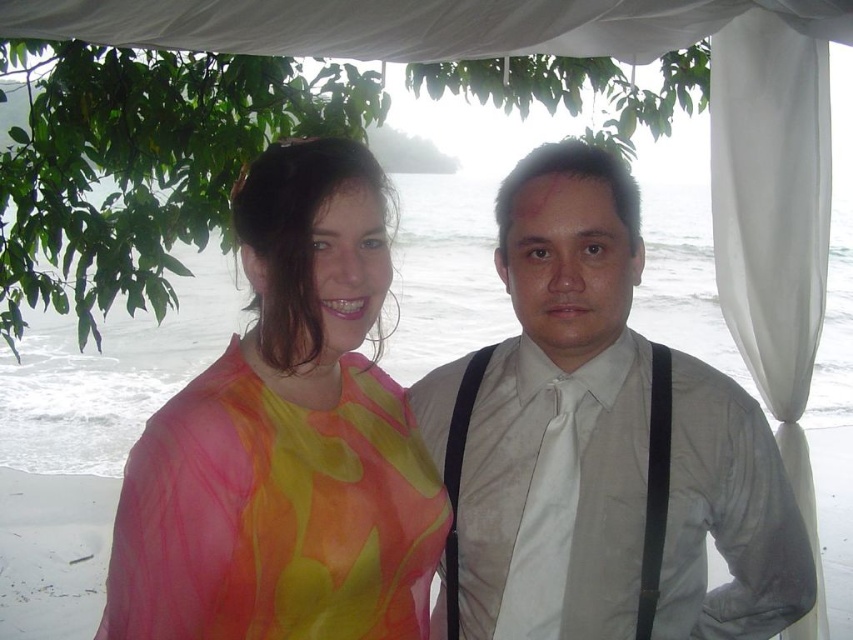
You are standing in front of the canopy at the beach. There are two points marked in the image. The first point is at coordinates point [3,337] and the second point is at point [804,358]. Which point is closer to you?

Point [3,337] is closer to you because it is further to the viewer than point [804,358].

You are a photographer setting up for a beach wedding photo session. You need to ensure that both the translucent floral blouse at center and the white satin tie at center are clearly visible in the frame. Given their sizes, which one might require more careful positioning to avoid being overshadowed by the other?

The white satin tie at center is smaller than the translucent floral blouse at center, so it might require more careful positioning to ensure it remains visible and isn not overshadowed by the larger blouse.

You are a photographer setting up for a beach wedding photoshoot. You need to ensure that the translucent floral blouse at center and the white satin tie at center are both visible in the frame. Given their sizes, which item might require more careful positioning to avoid being cut off?

The translucent floral blouse at center has a larger width than the white satin tie at center, so it might require more careful positioning to avoid being cut off.